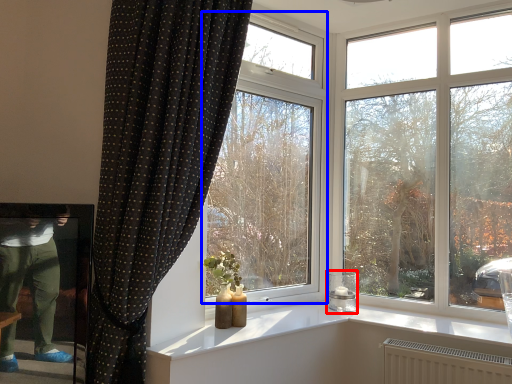
Question: Which of the following is the closest to the observer, candle holder (highlighted by a red box) or window (highlighted by a blue box)?

Choices:
 (A) candle holder
 (B) window

Answer: (B)